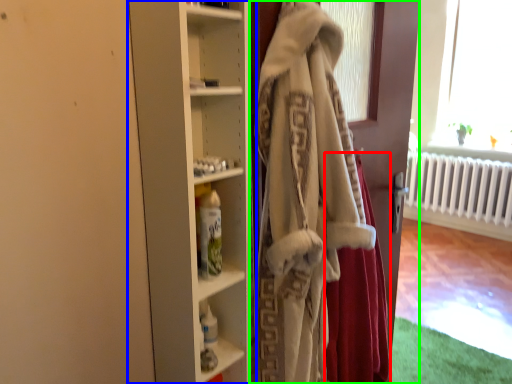
Question: Which object is positioned closest to shawl (highlighted by a red box)? Select from cupboard (highlighted by a blue box) and door (highlighted by a green box).

Choices:
 (A) cupboard
 (B) door

Answer: (B)